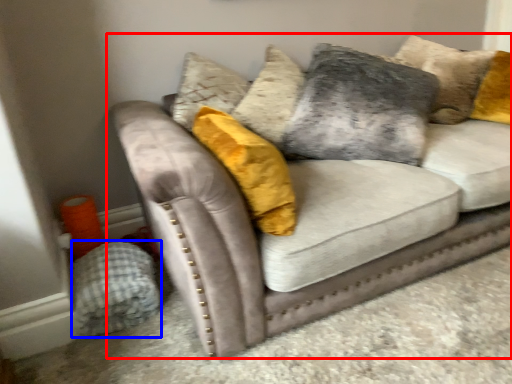
Question: Which of the following is the closest to the observer, studio couch (highlighted by a red box) or material (highlighted by a blue box)?

Choices:
 (A) studio couch
 (B) material

Answer: (A)